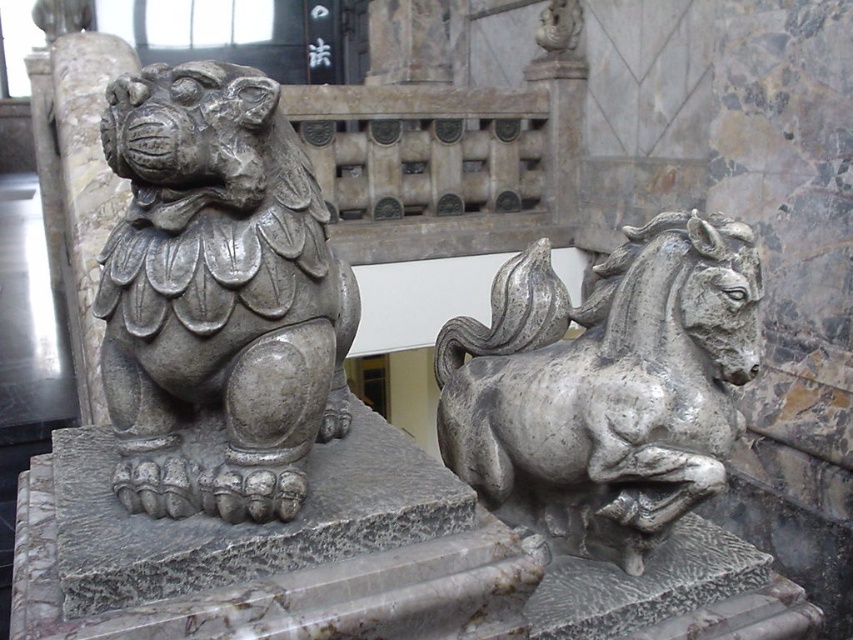
Question: Among these objects, which one is farthest from the camera?

Choices:
 (A) gray stone lion at left
 (B) gray stone horse at right

Answer: (B)

Question: Is gray stone lion at left smaller than gray stone horse at right?

Choices:
 (A) yes
 (B) no

Answer: (A)

Question: Is gray stone lion at left to the left of gray stone horse at right from the viewer's perspective?

Choices:
 (A) no
 (B) yes

Answer: (B)

Question: Does gray stone lion at left have a greater width compared to gray stone horse at right?

Choices:
 (A) yes
 (B) no

Answer: (B)